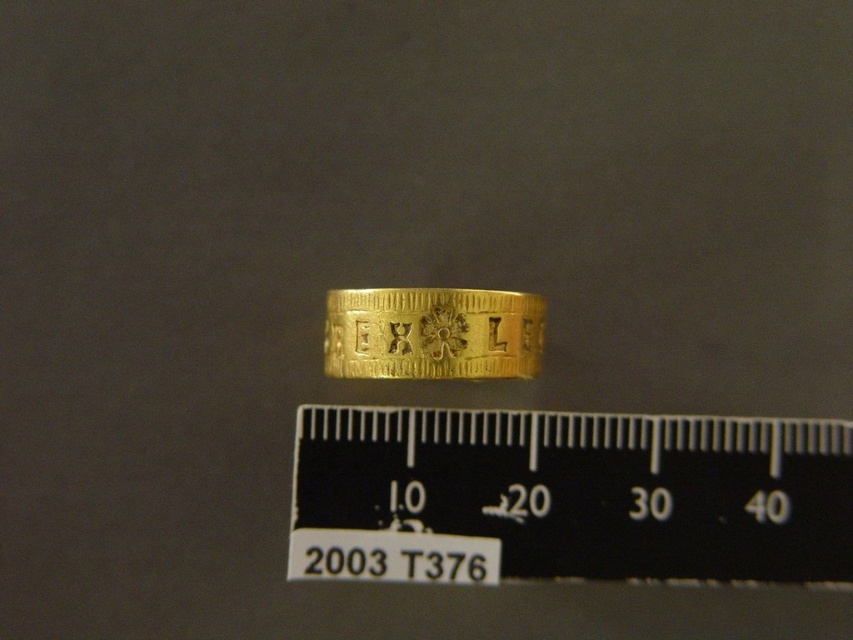
Who is lower down, black plastic ruler at center or goldsmoothring at center?

black plastic ruler at center

Does black plastic ruler at center have a lesser width compared to goldsmoothring at center?

In fact, black plastic ruler at center might be wider than goldsmoothring at center.

Does point (502, 545) come closer to viewer compared to point (535, 337)?

Yes, point (502, 545) is in front of point (535, 337).

Locate an element on the screen. black plastic ruler at center is located at coordinates (567, 497).